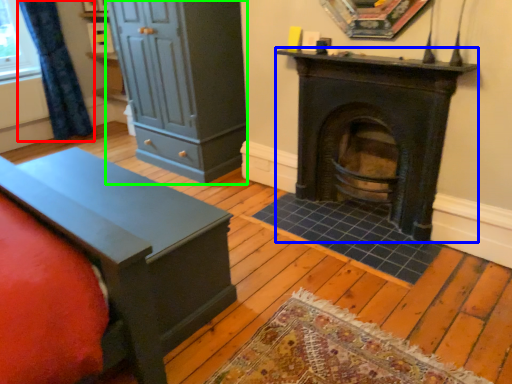
Question: Considering the real-world distances, which object is farthest from curtain (highlighted by a red box)? wood burning stove (highlighted by a blue box) or dresser (highlighted by a green box)?

Choices:
 (A) wood burning stove
 (B) dresser

Answer: (A)